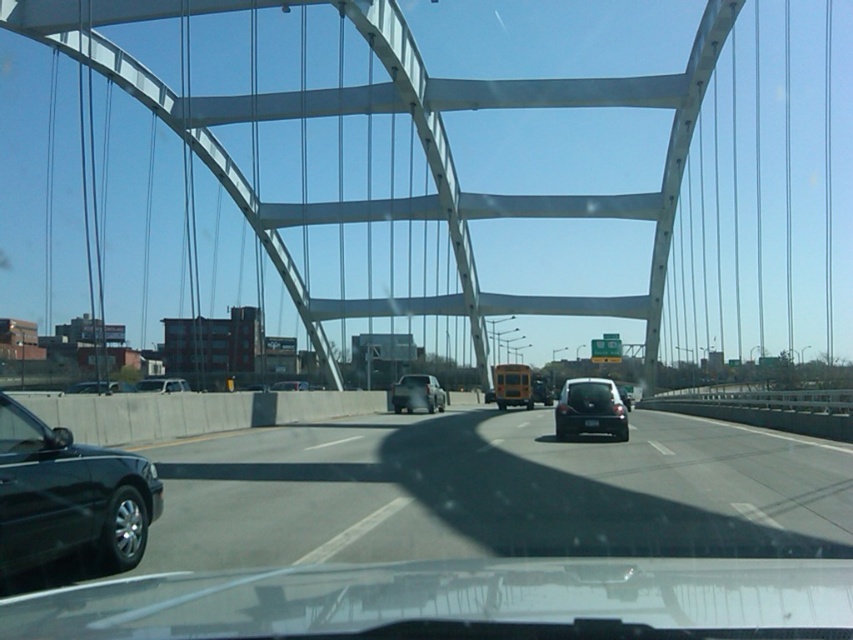
From the picture: You are driving a matte silver suv at center and want to switch lanes to the right. Is the matte black sedan at center in your blind spot? Consider their sizes and positions.

The matte silver suv at center is larger than the matte black sedan at center. Since the matte black sedan at center is smaller, it might be more likely to be in the blind spot of the matte silver suv at center when changing lanes.

You are driving a car and looking through the windshield. You see two points marked on the road ahead. The first point is at coordinates point (554, 422) and the second is at point (177, 388). Which point is closer to your current position?

Point (177, 388) is closer to your current position because it is behind point (554, 422), which is in front of it.